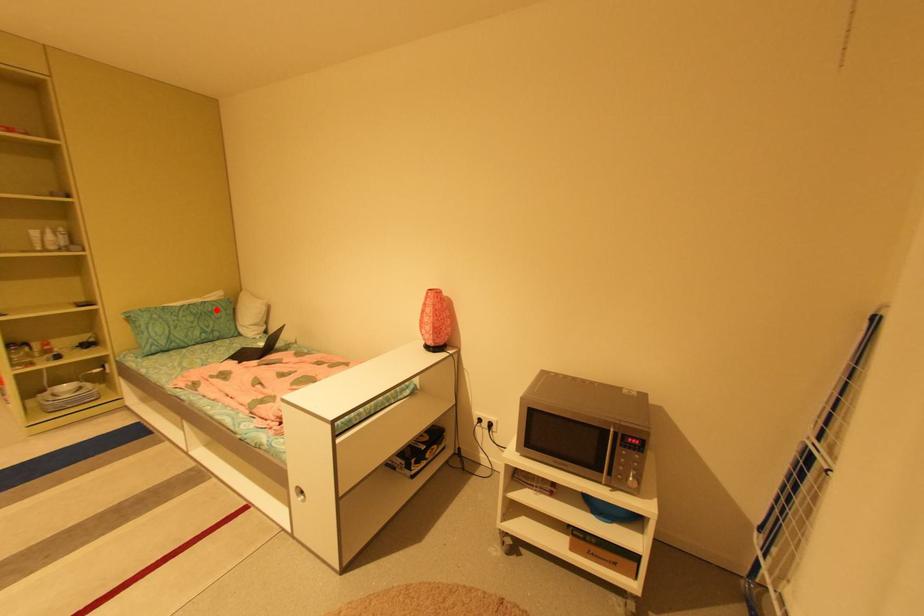
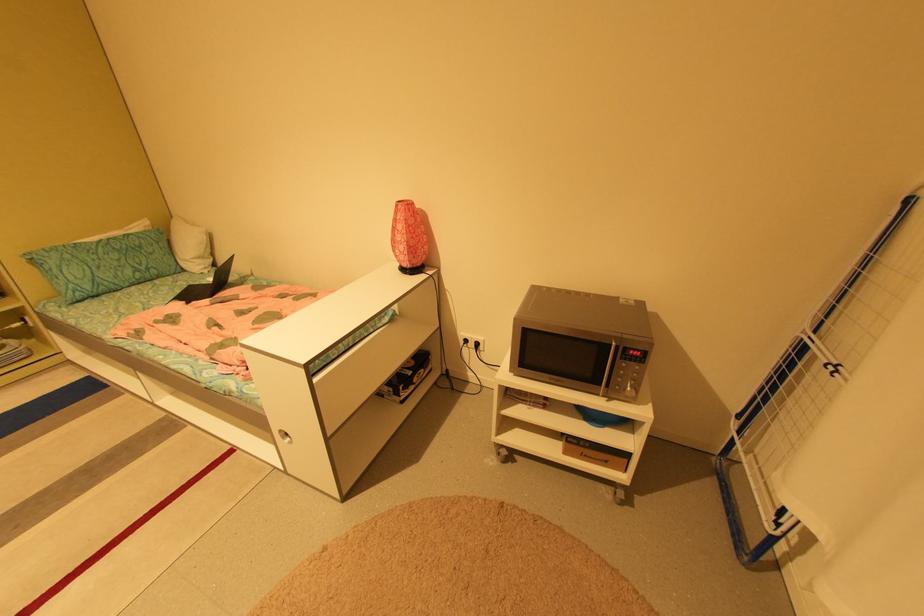
In the second image, find the point that corresponds to the highlighted location in the first image.

(142, 244)